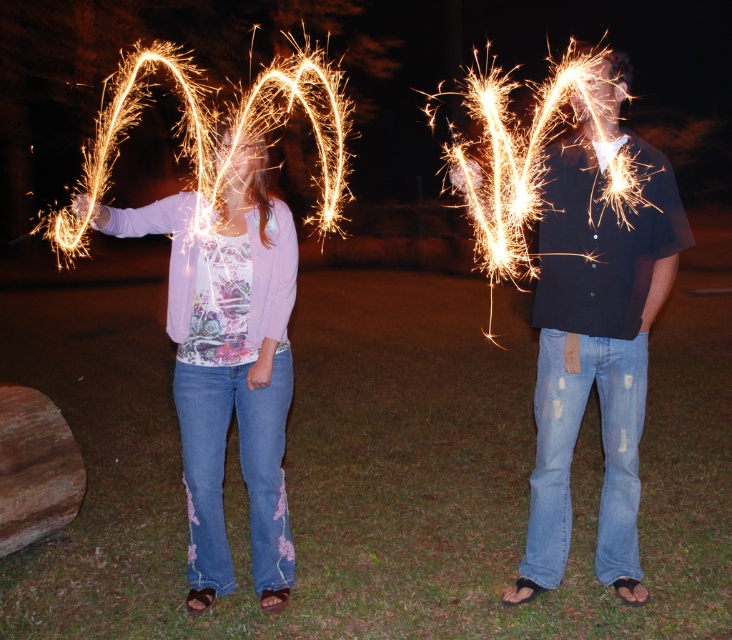
Question: Which of the following is the farthest from the observer?

Choices:
 (A) (253, 348)
 (B) (556, 220)

Answer: (A)

Question: Which of the following is the closest to the observer?

Choices:
 (A) (591, 305)
 (B) (294, 253)

Answer: (A)

Question: Can you confirm if matte black shirt at center is positioned below matte pink sweater at center?

Choices:
 (A) no
 (B) yes

Answer: (A)

Question: Can you confirm if matte black shirt at center is wider than matte pink sweater at center?

Choices:
 (A) no
 (B) yes

Answer: (B)

Question: Does matte black shirt at center appear on the right side of matte pink sweater at center?

Choices:
 (A) no
 (B) yes

Answer: (B)